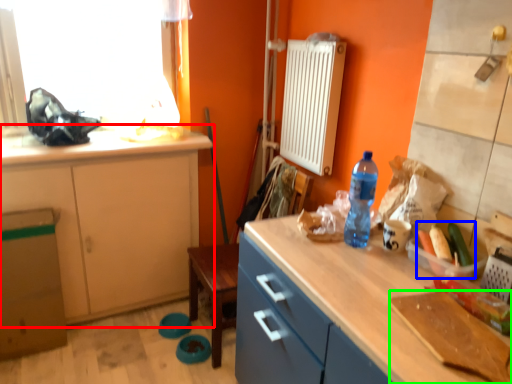
Question: Considering the real-world distances, which object is farthest from cabinetry (highlighted by a red box)? food (highlighted by a blue box) or cutting board (highlighted by a green box)?

Choices:
 (A) food
 (B) cutting board

Answer: (B)